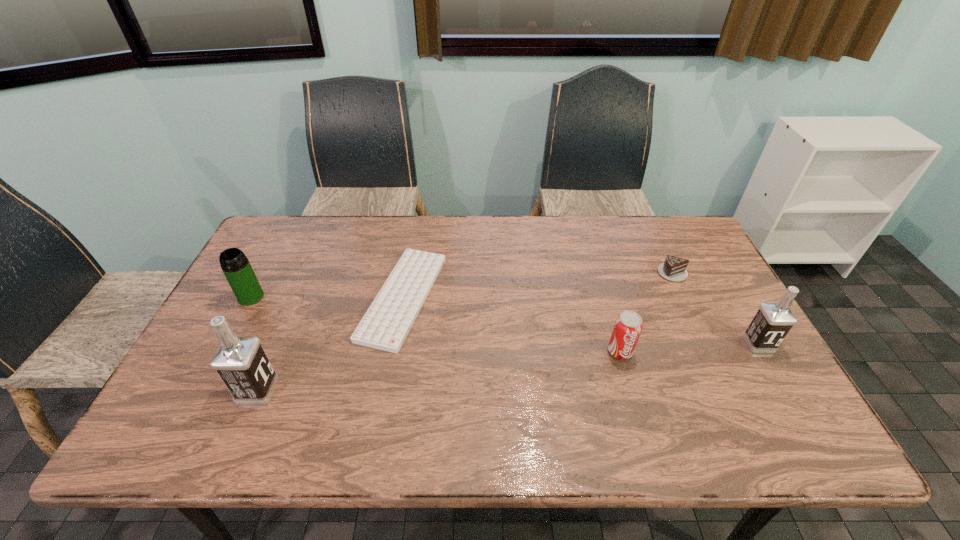
If the aim is uniform spacing by inserting an additional vodka among them, please point to a vacant space for this new vodka. Please provide its 2D coordinates. Your answer should be formatted as a tuple, i.e. [(x, y)], where the tuple contains the x and y coordinates of a point satisfying the conditions above.

[(519, 366)]